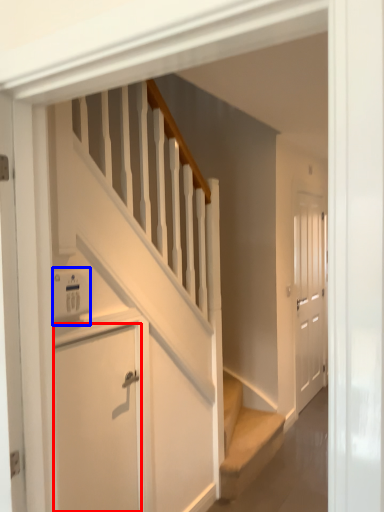
Question: Which of the following is the closest to the observer, door (highlighted by a red box) or appliance (highlighted by a blue box)?

Choices:
 (A) door
 (B) appliance

Answer: (B)